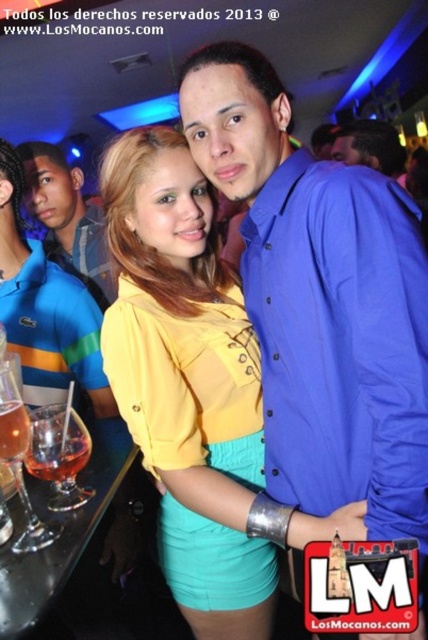
Consider the image. Can you confirm if translucent glass wine at lower left is positioned to the right of blue shirt at center?

No, translucent glass wine at lower left is not to the right of blue shirt at center.

Where is `translucent glass wine at lower left`? The width and height of the screenshot is (428, 640). translucent glass wine at lower left is located at coordinates (59, 452).

Locate an element on the screen. The image size is (428, 640). translucent glass wine at lower left is located at coordinates (59, 452).

Can you confirm if blue striped polo shirt at left is positioned to the left of matte blue shirt at center?

Incorrect, blue striped polo shirt at left is not on the left side of matte blue shirt at center.

Is blue striped polo shirt at left smaller than matte blue shirt at center?

Yes, blue striped polo shirt at left is smaller than matte blue shirt at center.

What do you see at coordinates (45, 308) in the screenshot? I see `blue striped polo shirt at left` at bounding box center [45, 308].

You are a GUI agent. You are given a task and a screenshot of the screen. Output one action in this format:
    pyautogui.click(x=<x>, y=<y>)
    Task: Click on the blue striped polo shirt at left
    This screenshot has width=428, height=640.
    Given the screenshot: What is the action you would take?
    45,308

Is blue striped polo shirt at left thinner than translucent glass drink at lower left?

Incorrect, blue striped polo shirt at left's width is not less than translucent glass drink at lower left's.

In the scene shown: Measure the distance from blue striped polo shirt at left to translucent glass drink at lower left.

blue striped polo shirt at left is 23.35 inches away from translucent glass drink at lower left.

The height and width of the screenshot is (640, 428). Identify the location of blue striped polo shirt at left. (45, 308).